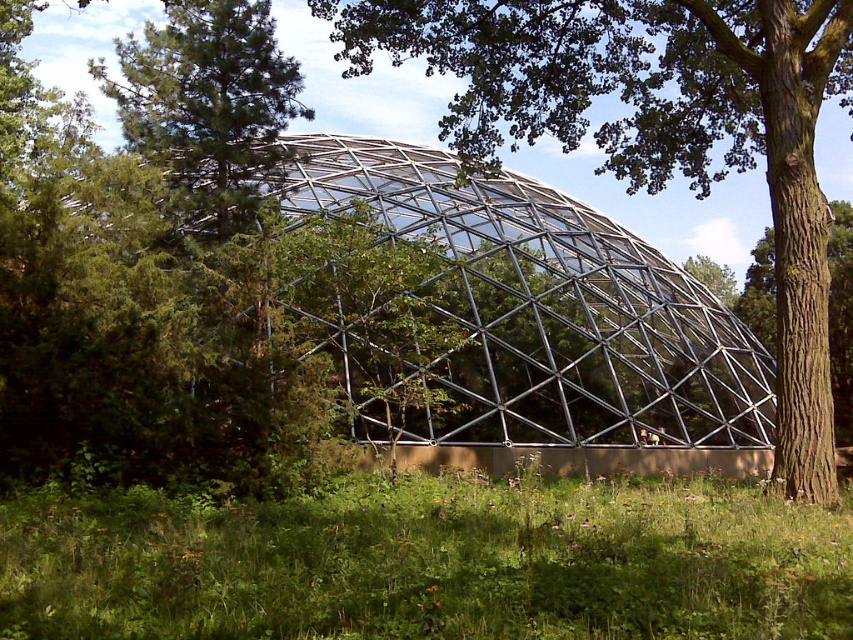
You are standing outside the geodesic dome and notice the green grass at center and the brown rough bark tree at right. Which of these two objects is larger in size?

The brown rough bark tree at right is larger than the green grass at center.

You are standing inside the geodesic dome and want to move from the point at coordinates point (704, 598) to the point at coordinates point (674, 120). Which direction should you move to get closer to your destination?

You should move backward because point (704, 598) is in front of point (674, 120), so moving backward will bring you closer to the destination.

You are planning to place a small garden statue that requires a 2x2 meter space. Based on the scene, can the green grass at center accommodate this statue without encroaching on the brown rough tree at center?

The green grass at center has a smaller size compared to brown rough tree at center, so it may not have enough space to accommodate a 2x2 meter statue without overlapping with the tree.